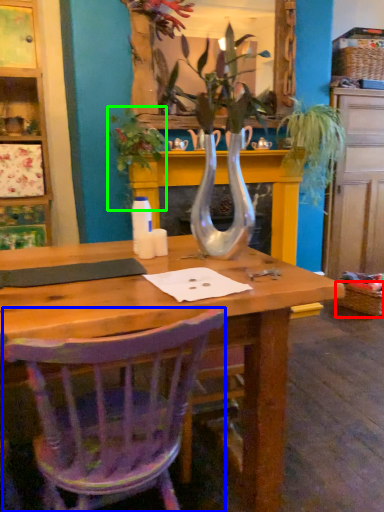
Question: Based on their relative distances, which object is farther from picnic basket (highlighted by a red box)? Choose from chair (highlighted by a blue box) and plant (highlighted by a green box).

Choices:
 (A) chair
 (B) plant

Answer: (A)